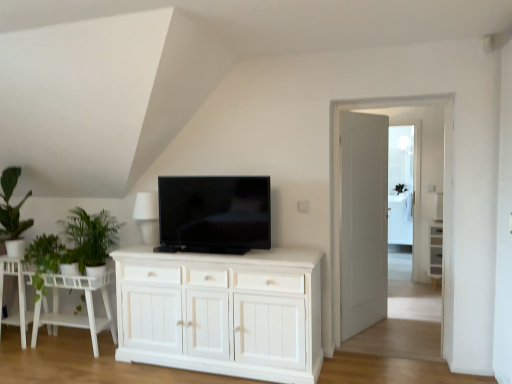
Image resolution: width=512 pixels, height=384 pixels. What are the coordinates of `free spot to the right of white wooden door at center` in the screenshot? It's located at (410, 327).